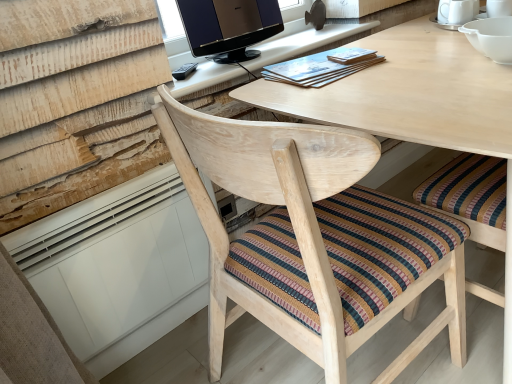
Where is `free space in front of matte wooden book at upper center, the 1th book when ordered from left to right`? free space in front of matte wooden book at upper center, the 1th book when ordered from left to right is located at coordinates (358, 91).